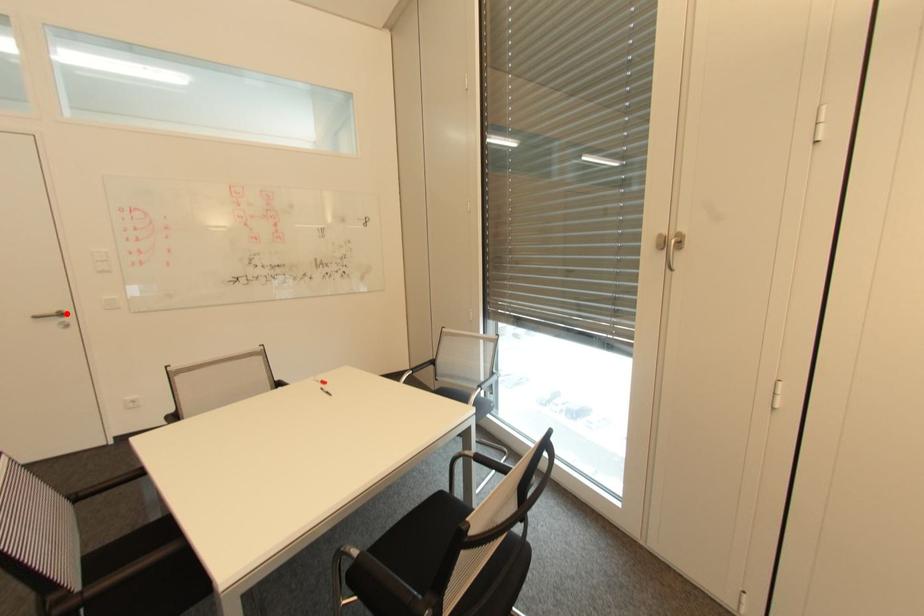
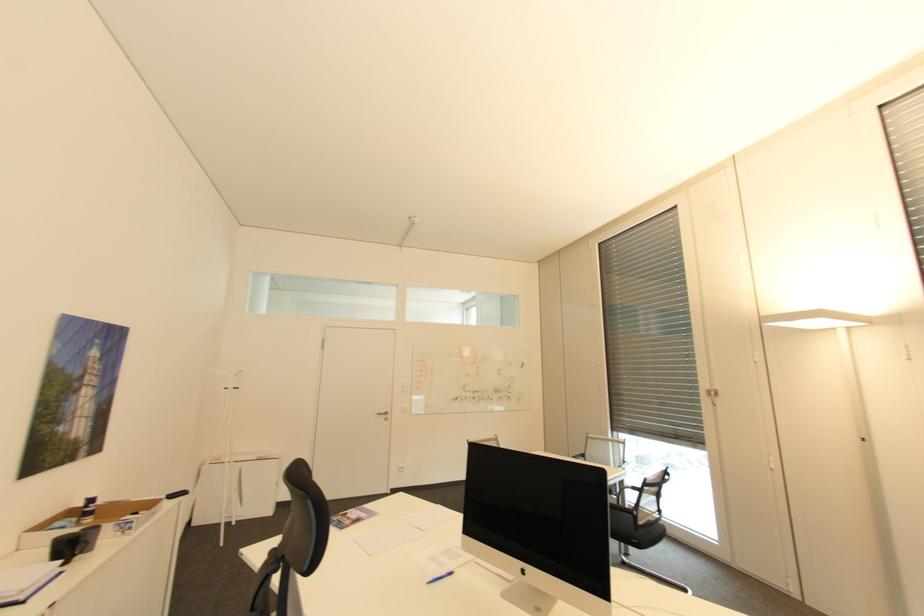
The point at the highlighted location is marked in the first image. Where is the corresponding point in the second image?

(391, 413)